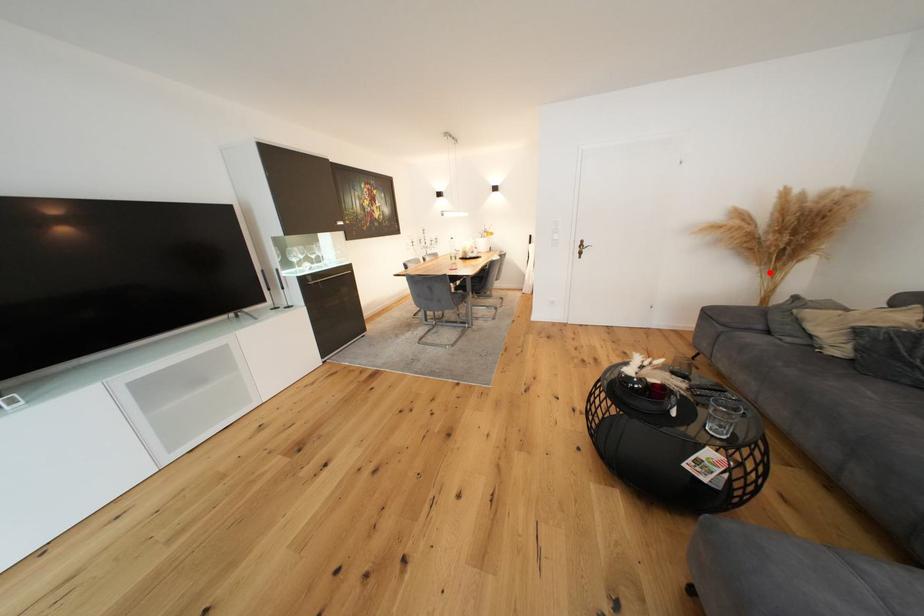
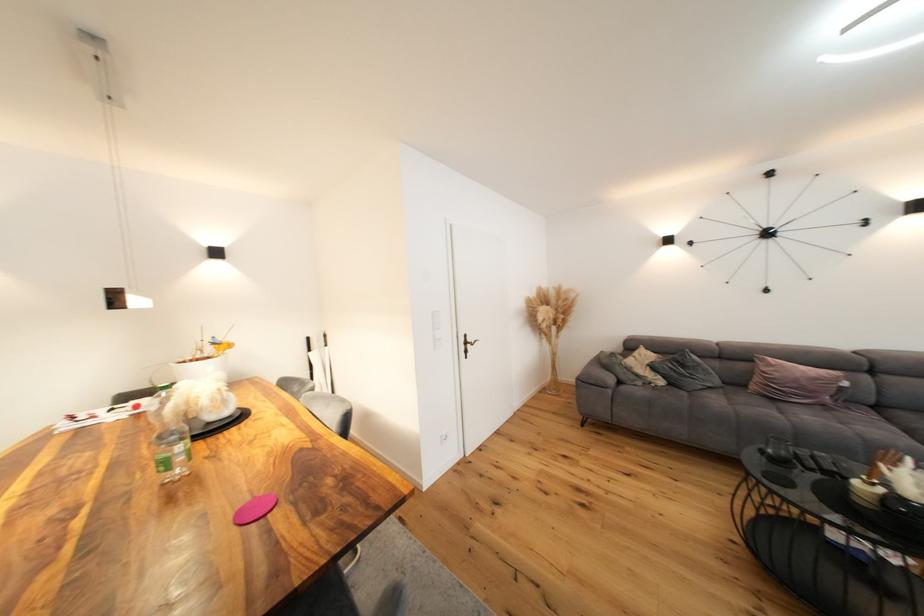
The point at the highlighted location is marked in the first image. Where is the corresponding point in the second image?

(548, 342)